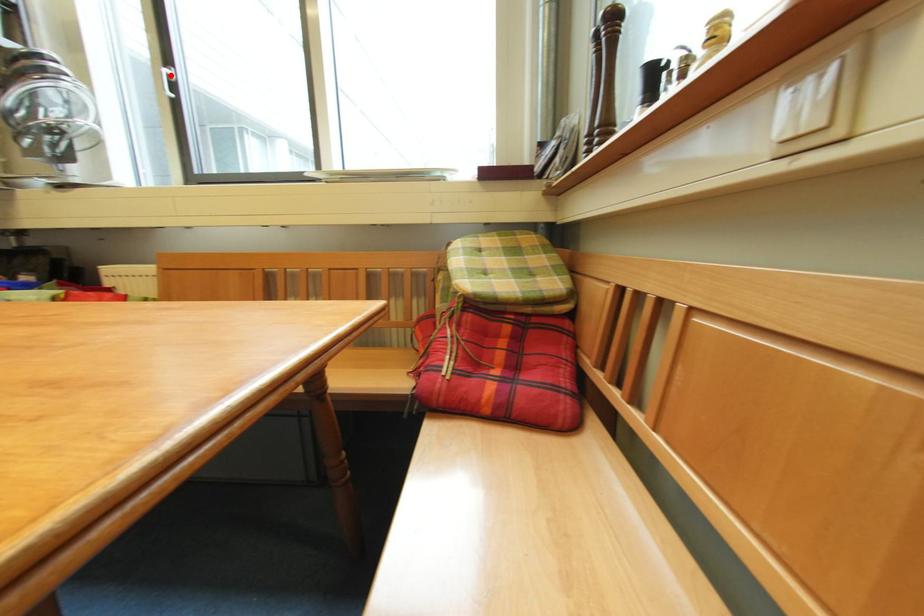
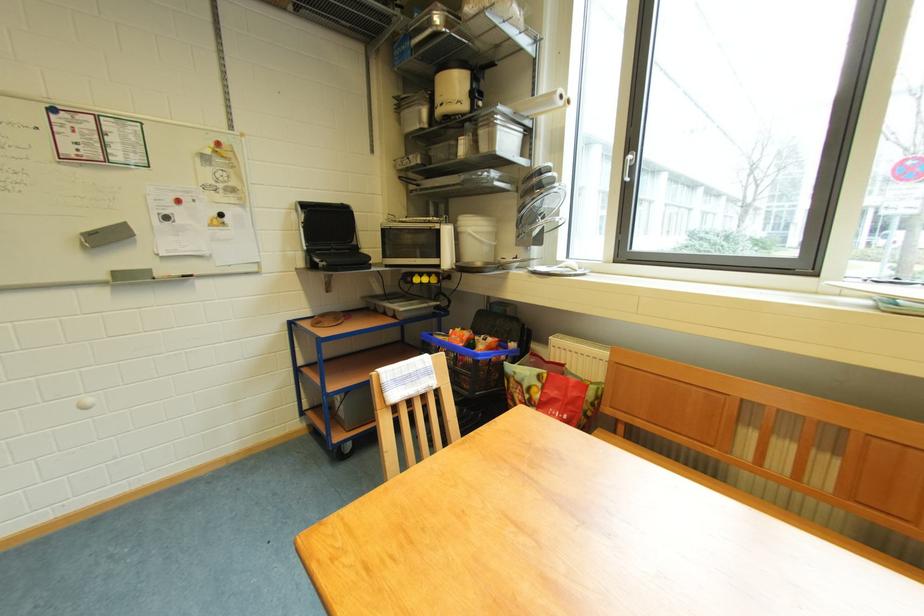
Question: I am providing you with two images of the same scene from different viewpoints. A red point is marked on the first image. At the location where the point appears in image 1, is it still visible in image 2?

Choices:
 (A) Yes
 (B) No

Answer: (A)